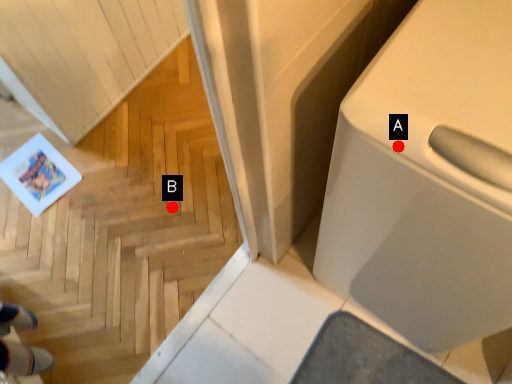
Question: Two points are circled on the image, labeled by A and B beside each circle. Which point is further to the camera?

Choices:
 (A) A is further
 (B) B is further

Answer: (B)